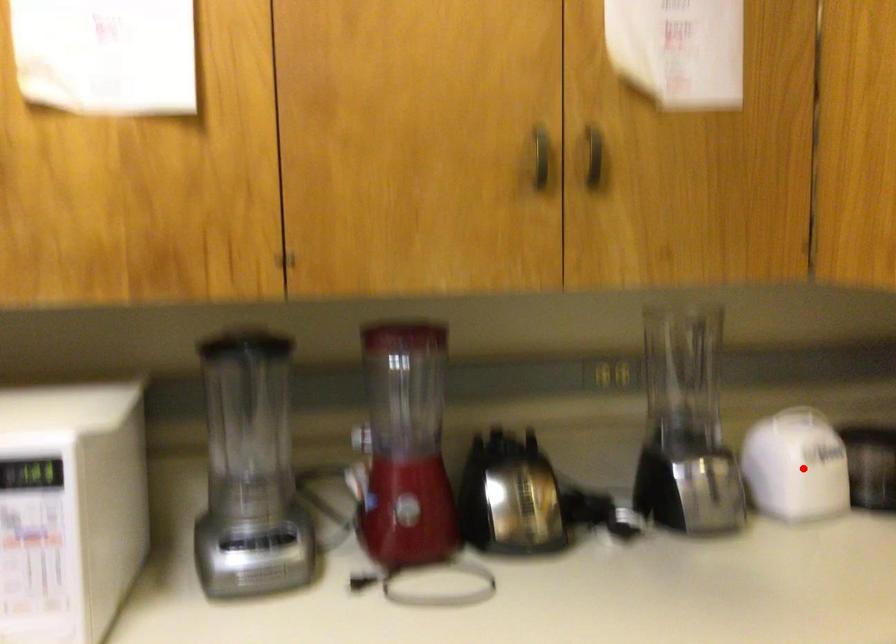
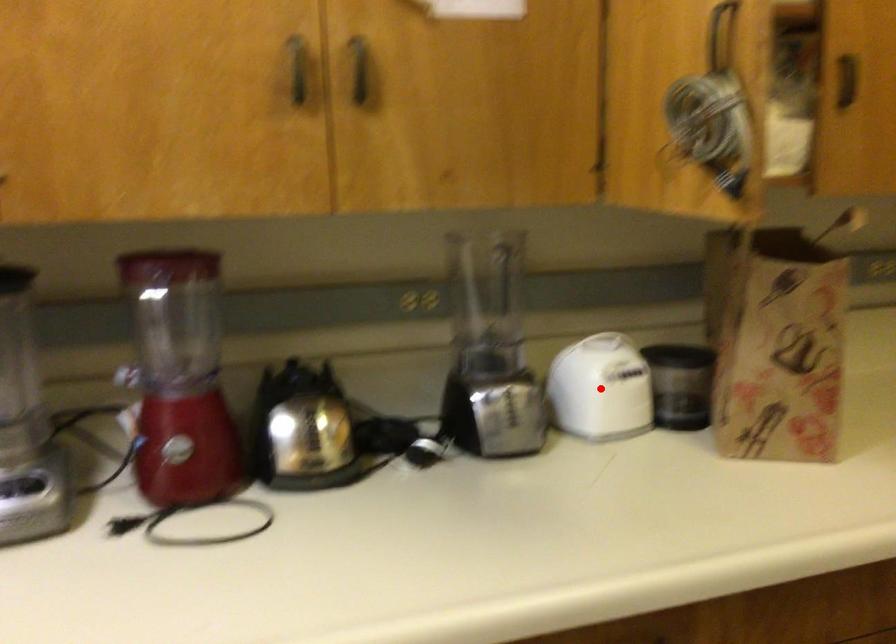
I am providing you with two images of the same scene from different viewpoints. A red point is marked on the first image and another point is marked on the second image. Do the highlighted points in image1 and image2 indicate the same real-world spot?

Yes